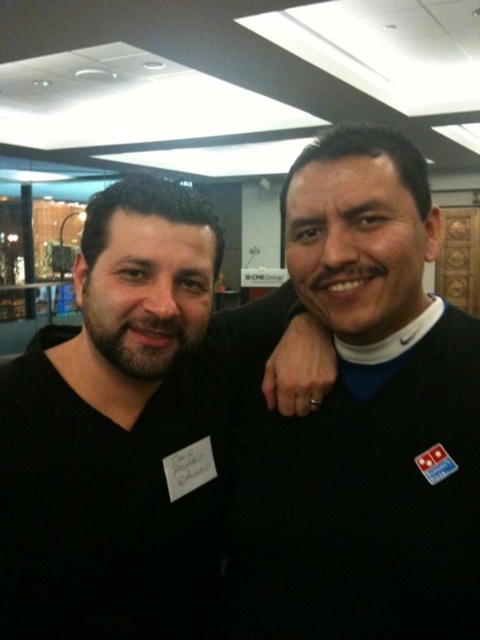
You are organizing a clothing donation drive and need to categorize items by size. You have two items to sort out. The black sweater at right and the black matte shirt at center. Which one is smaller?

The black sweater at right is smaller than the black matte shirt at center.

You are an event organizer who needs to place a name tag on the black sweater at right. According to the image, what are the coordinates where you should place the name tag?

The coordinates for the black sweater at right are at point (363, 422), so the name tag should be placed there.

From the picture: You are standing in the room where the two people are, and you want to move from the point at coordinates point (372, 502) to the point at coordinates point (105, 548). Which direction should you move in?

You should move downward and to the right because point (372, 502) is in front of point (105, 548), indicating that it is closer to the viewer. Moving towards the latter would require going away from the viewer, which typically corresponds to a downward and rightward direction in such coordinate systems.